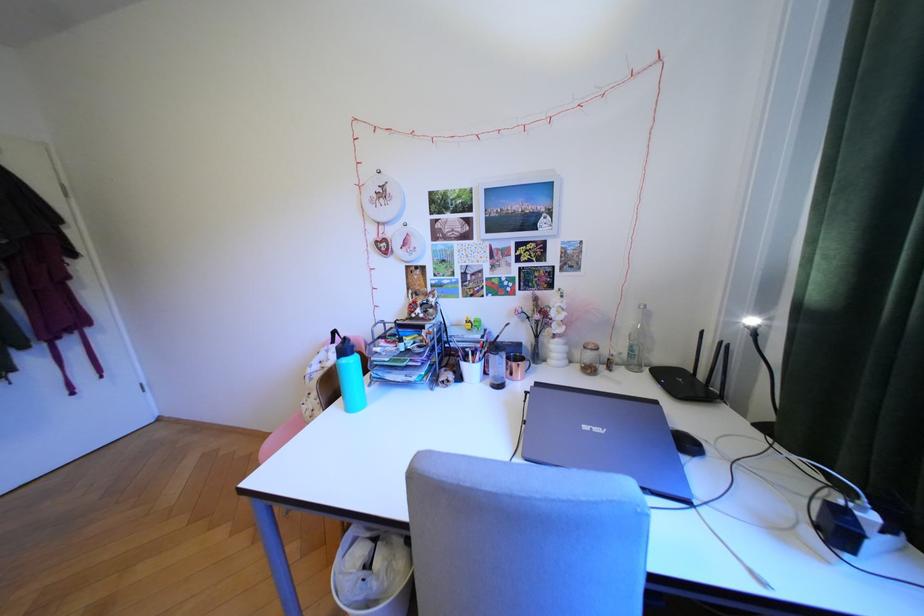
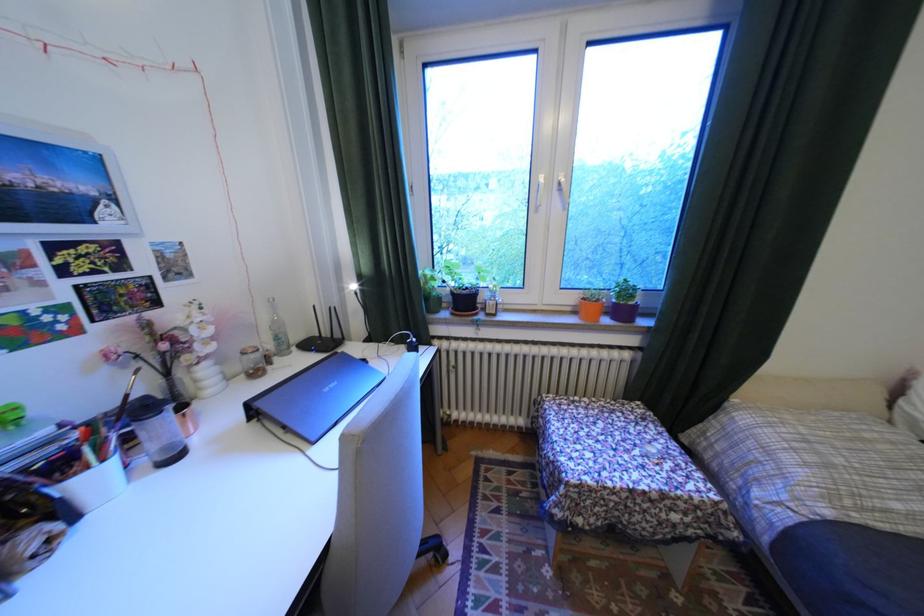
Find the pixel in the second image that matches (x=642, y=347) in the first image.

(287, 338)